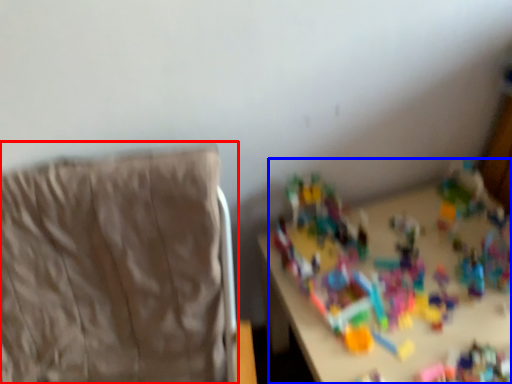
Question: Which object appears farthest to the camera in this image, furniture (highlighted by a red box) or toy (highlighted by a blue box)?

Choices:
 (A) furniture
 (B) toy

Answer: (B)